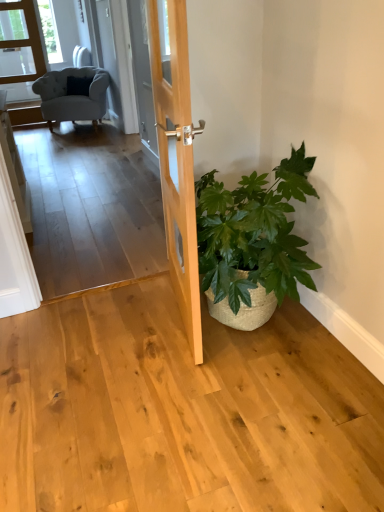
Question: Is green woven basket at lower right at the back of light brown wood door at center?

Choices:
 (A) no
 (B) yes

Answer: (B)

Question: From the image's perspective, is light brown wood door at center beneath green woven basket at lower right?

Choices:
 (A) no
 (B) yes

Answer: (A)

Question: Does light brown wood door at center appear on the left side of green woven basket at lower right?

Choices:
 (A) no
 (B) yes

Answer: (B)

Question: Is the surface of light brown wood door at center in direct contact with green woven basket at lower right?

Choices:
 (A) no
 (B) yes

Answer: (A)

Question: Does light brown wood door at center have a greater height compared to green woven basket at lower right?

Choices:
 (A) no
 (B) yes

Answer: (B)

Question: Is light gray fabric armchair at upper left situated inside transparent glass door at upper left or outside?

Choices:
 (A) outside
 (B) inside

Answer: (A)

Question: Looking at their shapes, would you say light gray fabric armchair at upper left is wider or thinner than transparent glass door at upper left?

Choices:
 (A) wide
 (B) thin

Answer: (A)

Question: Looking at the image, does light gray fabric armchair at upper left seem bigger or smaller compared to transparent glass door at upper left?

Choices:
 (A) big
 (B) small

Answer: (A)

Question: In terms of height, does light gray fabric armchair at upper left look taller or shorter compared to transparent glass door at upper left?

Choices:
 (A) tall
 (B) short

Answer: (B)

Question: Relative to green woven basket at lower right, is light gray fabric armchair at upper left in front or behind?

Choices:
 (A) front
 (B) behind

Answer: (B)

Question: From a real-world perspective, relative to green woven basket at lower right, is light gray fabric armchair at upper left vertically above or below?

Choices:
 (A) above
 (B) below

Answer: (A)

Question: Is light gray fabric armchair at upper left inside the boundaries of green woven basket at lower right, or outside?

Choices:
 (A) outside
 (B) inside

Answer: (A)

Question: From the image's perspective, relative to green woven basket at lower right, is light gray fabric armchair at upper left above or below?

Choices:
 (A) below
 (B) above

Answer: (B)

Question: Is green woven basket at lower right in front of or behind light gray fabric armchair at upper left in the image?

Choices:
 (A) front
 (B) behind

Answer: (A)

Question: In the image, is green woven basket at lower right on the left side or the right side of light gray fabric armchair at upper left?

Choices:
 (A) left
 (B) right

Answer: (B)